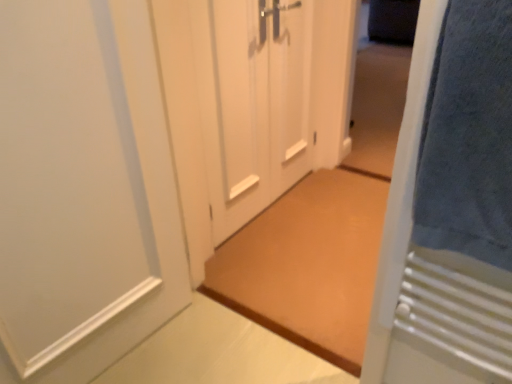
Question: Does white matte door at center, acting as the 2th door starting from the right, touch blue soft towel at right?

Choices:
 (A) no
 (B) yes

Answer: (A)

Question: Could you tell me if white matte door at center, acting as the 2th door starting from the right, is turned towards blue soft towel at right?

Choices:
 (A) no
 (B) yes

Answer: (A)

Question: Is white matte door at center, acting as the 2th door starting from the right, not within blue soft towel at right?

Choices:
 (A) yes
 (B) no

Answer: (A)

Question: From a real-world perspective, is white matte door at center, acting as the 2th door starting from the right, beneath blue soft towel at right?

Choices:
 (A) yes
 (B) no

Answer: (A)

Question: Can you confirm if white matte door at center, placed as the 3th door when sorted from left to right, is positioned to the left of blue soft towel at right?

Choices:
 (A) yes
 (B) no

Answer: (A)

Question: Considering the relative sizes of white matte door at center, acting as the 2th door starting from the right, and blue soft towel at right in the image provided, is white matte door at center, acting as the 2th door starting from the right, smaller than blue soft towel at right?

Choices:
 (A) yes
 (B) no

Answer: (B)

Question: Is blue soft towel at right outside of white matte door at center, acting as the 2th door starting from the right?

Choices:
 (A) no
 (B) yes

Answer: (B)

Question: Does blue soft towel at right appear on the left side of white matte door at center, placed as the 3th door when sorted from left to right?

Choices:
 (A) yes
 (B) no

Answer: (B)

Question: Is blue soft towel at right surrounding white matte door at center, placed as the 3th door when sorted from left to right?

Choices:
 (A) yes
 (B) no

Answer: (B)

Question: Can you confirm if blue soft towel at right is shorter than white matte door at center, placed as the 3th door when sorted from left to right?

Choices:
 (A) no
 (B) yes

Answer: (B)

Question: Can you confirm if blue soft towel at right is smaller than white matte door at center, placed as the 3th door when sorted from left to right?

Choices:
 (A) yes
 (B) no

Answer: (A)

Question: Is blue soft towel at right facing towards white matte door at center, placed as the 3th door when sorted from left to right?

Choices:
 (A) no
 (B) yes

Answer: (A)

Question: Is blue soft towel at right outside white matte door at left, the first door when ordered from left to right?

Choices:
 (A) no
 (B) yes

Answer: (B)